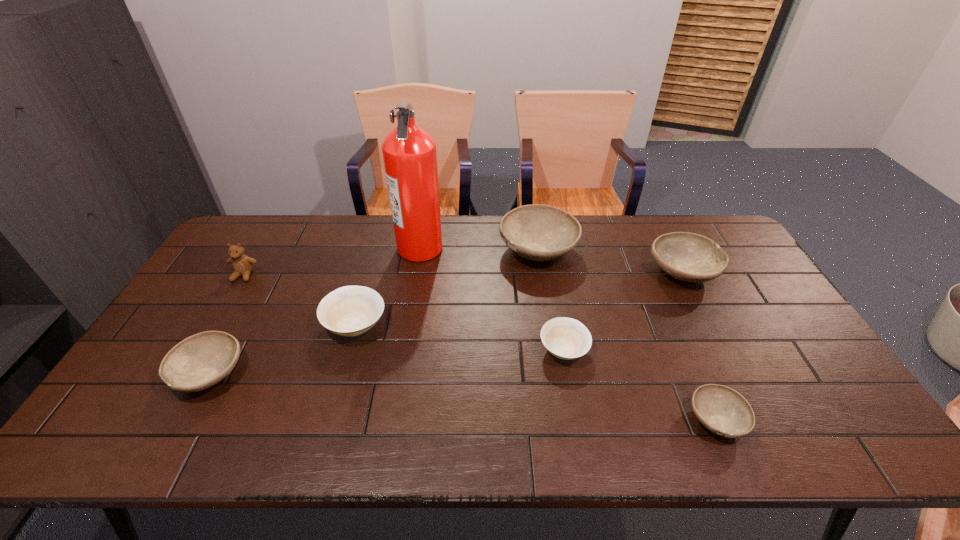
Locate an element on the screen. Image resolution: width=960 pixels, height=540 pixels. the closest gray bowl relative to the second bowl from left to right is located at coordinates (200, 361).

Where is `gray bowl that is the second closest to the leftmost bowl`? Image resolution: width=960 pixels, height=540 pixels. gray bowl that is the second closest to the leftmost bowl is located at coordinates (722, 410).

I want to click on blank area in the image that satisfies the following two spatial constraints: 1. at the nozzle of the right beige bowl; 2. on the left side of the tallest object, so click(404, 350).

Locate an element on the screen. vacant area that satisfies the following two spatial constraints: 1. on the back side of the third gray bowl from right to left; 2. at the nozzle of the fire extinguisher is located at coordinates (538, 247).

Identify the location of free region that satisfies the following two spatial constraints: 1. at the nozzle of the fire extinguisher; 2. on the front-facing side of the teddy bear. Image resolution: width=960 pixels, height=540 pixels. (416, 275).

Find the location of a particular element. This screenshot has height=540, width=960. vacant space that satisfies the following two spatial constraints: 1. at the nozzle of the fire extinguisher; 2. on the front-facing side of the teddy bear is located at coordinates [416, 275].